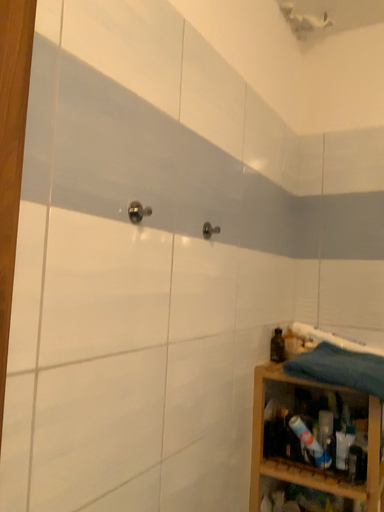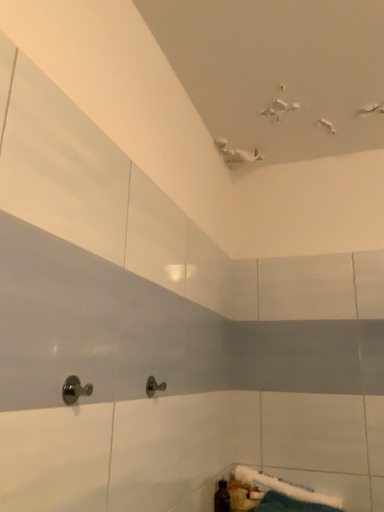
Question: How did the camera likely rotate when shooting the video?

Choices:
 (A) rotated right
 (B) rotated left

Answer: (A)